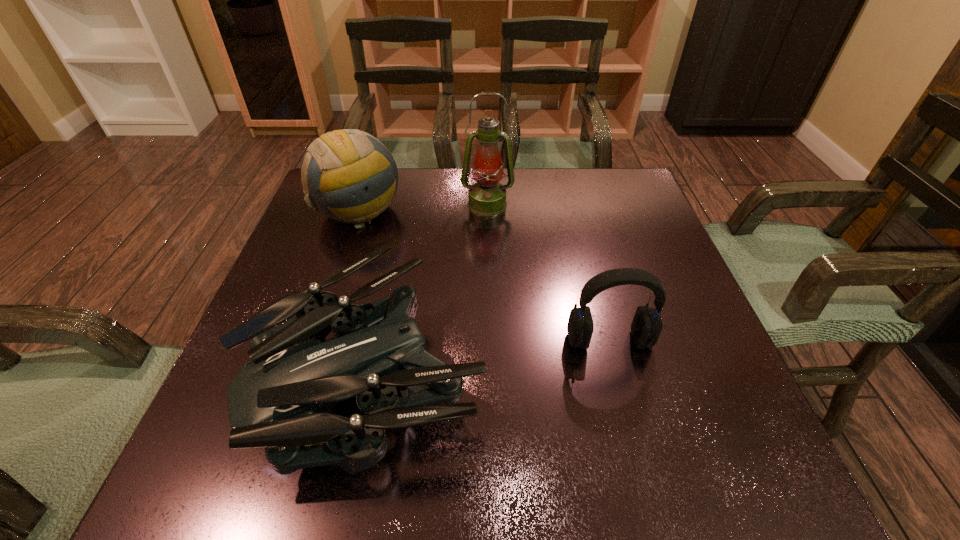
At what (x,y) coordinates should I click in order to perform the action: click on vacant space at the right edge. Please return your answer as a coordinate pair (x, y). The height and width of the screenshot is (540, 960). Looking at the image, I should click on (670, 360).

Identify the location of vacant space at the far right corner of the desktop. (591, 207).

At what (x,y) coordinates should I click in order to perform the action: click on free spot between the volleyball and the tallest object. Please return your answer as a coordinate pair (x, y). This screenshot has height=540, width=960. Looking at the image, I should click on (422, 207).

Where is `free space between the oil lamp and the volleyball`? This screenshot has width=960, height=540. free space between the oil lamp and the volleyball is located at coordinates (422, 207).

You are a GUI agent. You are given a task and a screenshot of the screen. Output one action in this format:
    pyautogui.click(x=<x>, y=<y>)
    Task: Click on the free space between the shortest object and the headset
    The image size is (960, 540).
    Given the screenshot: What is the action you would take?
    pyautogui.click(x=490, y=355)

At what (x,y) coordinates should I click in order to perform the action: click on free space between the oil lamp and the third shortest object. Please return your answer as a coordinate pair (x, y). This screenshot has width=960, height=540. Looking at the image, I should click on (422, 207).

Locate an element on the screen. unoccupied area between the drone and the rightmost object is located at coordinates (490, 355).

Identify the location of blank region between the rightmost object and the oil lamp. (548, 272).

I want to click on vacant area that lies between the oil lamp and the third tallest object, so click(x=548, y=272).

Image resolution: width=960 pixels, height=540 pixels. In order to click on vacant area that lies between the volleyball and the rightmost object in this screenshot , I will do `click(484, 275)`.